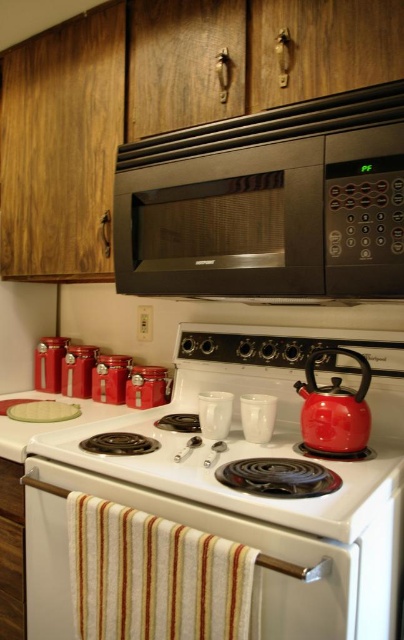
Question: Which of the following is the closest to the observer?

Choices:
 (A) (235, 221)
 (B) (389, 458)
 (C) (31, 440)

Answer: (B)

Question: Which point is farther to the camera?

Choices:
 (A) (105, 403)
 (B) (242, 497)
 (C) (321, 408)

Answer: (A)

Question: Can you confirm if black matte microwave at upper center is bigger than clear glass plate at upper center?

Choices:
 (A) no
 (B) yes

Answer: (B)

Question: Can you confirm if white glossy stove at center is positioned to the left of white glossy gas stove at center?

Choices:
 (A) no
 (B) yes

Answer: (A)

Question: Which object appears farthest from the camera in this image?

Choices:
 (A) white glossy gas stove at center
 (B) black matte microwave at upper center
 (C) shiny red teapot at stove top
 (D) white glossy stove at center

Answer: (C)

Question: Is white glossy stove at center wider than shiny red teapot at stove top?

Choices:
 (A) no
 (B) yes

Answer: (B)